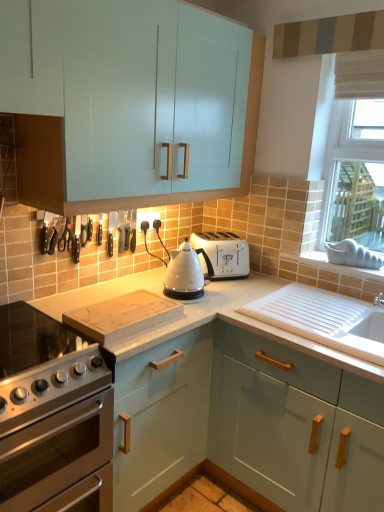
Question: Is the depth of wooden cutting board at center less than that of white fabric window at upper right?

Choices:
 (A) no
 (B) yes

Answer: (B)

Question: Is wooden cutting board at center thinner than white fabric window at upper right?

Choices:
 (A) no
 (B) yes

Answer: (A)

Question: Can you confirm if wooden cutting board at center is bigger than white fabric window at upper right?

Choices:
 (A) no
 (B) yes

Answer: (A)

Question: Is wooden cutting board at center completely or partially outside of white fabric window at upper right?

Choices:
 (A) yes
 (B) no

Answer: (A)

Question: Considering the relative sizes of wooden cutting board at center and white fabric window at upper right in the image provided, is wooden cutting board at center smaller than white fabric window at upper right?

Choices:
 (A) yes
 (B) no

Answer: (A)

Question: Is satin silver gas stove at lower left inside or outside of white ceramic sink at lower right?

Choices:
 (A) outside
 (B) inside

Answer: (A)

Question: Is satin silver gas stove at lower left taller or shorter than white ceramic sink at lower right?

Choices:
 (A) tall
 (B) short

Answer: (A)

Question: In the image, is satin silver gas stove at lower left on the left side or the right side of white ceramic sink at lower right?

Choices:
 (A) right
 (B) left

Answer: (B)

Question: Considering their positions, is satin silver gas stove at lower left located in front of or behind white ceramic sink at lower right?

Choices:
 (A) behind
 (B) front

Answer: (B)

Question: Is satin silver gas stove at lower left bigger or smaller than stainless steel oven at lower left?

Choices:
 (A) big
 (B) small

Answer: (B)

Question: Is point (33, 308) positioned closer to the camera than point (100, 393)?

Choices:
 (A) closer
 (B) farther

Answer: (B)

Question: Considering the positions of satin silver gas stove at lower left and stainless steel oven at lower left in the image, is satin silver gas stove at lower left taller or shorter than stainless steel oven at lower left?

Choices:
 (A) tall
 (B) short

Answer: (B)

Question: Is satin silver gas stove at lower left in front of or behind stainless steel oven at lower left in the image?

Choices:
 (A) front
 (B) behind

Answer: (B)

Question: Considering the positions of satin silver gas stove at lower left and glossy teal cabinet at lower right, which is the first cabinetry in bottom-to-top order, in the image, is satin silver gas stove at lower left taller or shorter than glossy teal cabinet at lower right, which is the first cabinetry in bottom-to-top order,?

Choices:
 (A) tall
 (B) short

Answer: (B)

Question: From the image's perspective, is satin silver gas stove at lower left located above or below glossy teal cabinet at lower right, which is the first cabinetry in bottom-to-top order?

Choices:
 (A) above
 (B) below

Answer: (A)